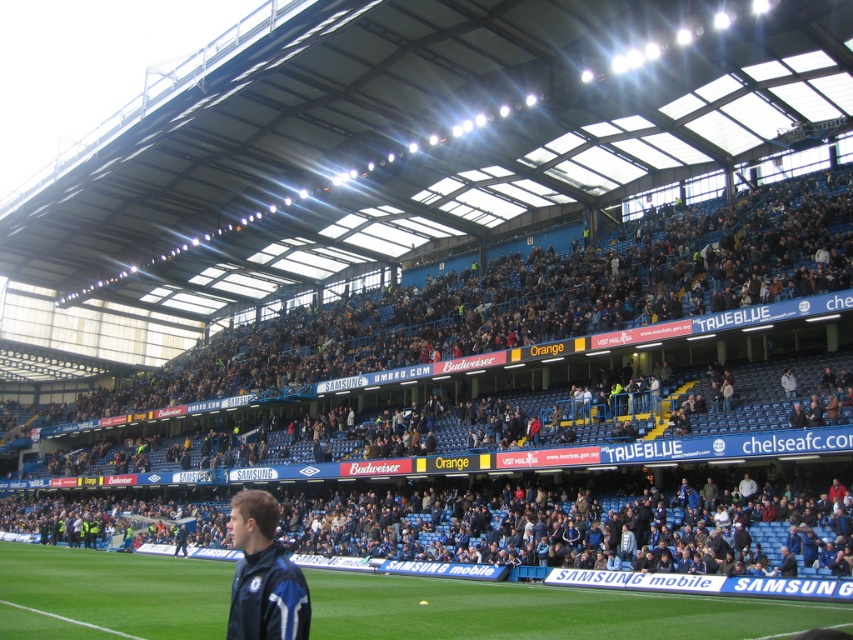
You are a photographer standing at the edge of the field in the football stadium. You want to take a photo that includes both the blue fabric seats at upper center and the green grass at center. Which object should you focus on first to ensure both are in the frame?

You should focus on the blue fabric seats at upper center first because it is closer to you than the green grass at center, ensuring both are in the frame.

You are a photographer standing at the camera position in the stadium. You want to capture a closeup of the blue fabric seats at upper center. Given that your camera can focus on objects up to 50 meters away, will you be able to get a clear shot?

The blue fabric seats at upper center is 50.18 meters from camera, so the camera cannot focus on it because it is beyond the 50 meters range.

In the scene shown: You are a drone operator trying to capture aerial footage of the football stadium. Your drone has a maximum flight range of 50 meters. If you are positioned at the viewer location, can your drone reach the blue fabric seats at upper center?

The distance between the viewer and the blue fabric seats at upper center is 50.18 meters, which exceeds the drone maximum flight range of 50 meters. Therefore, the drone cannot reach the blue fabric seats at upper center.